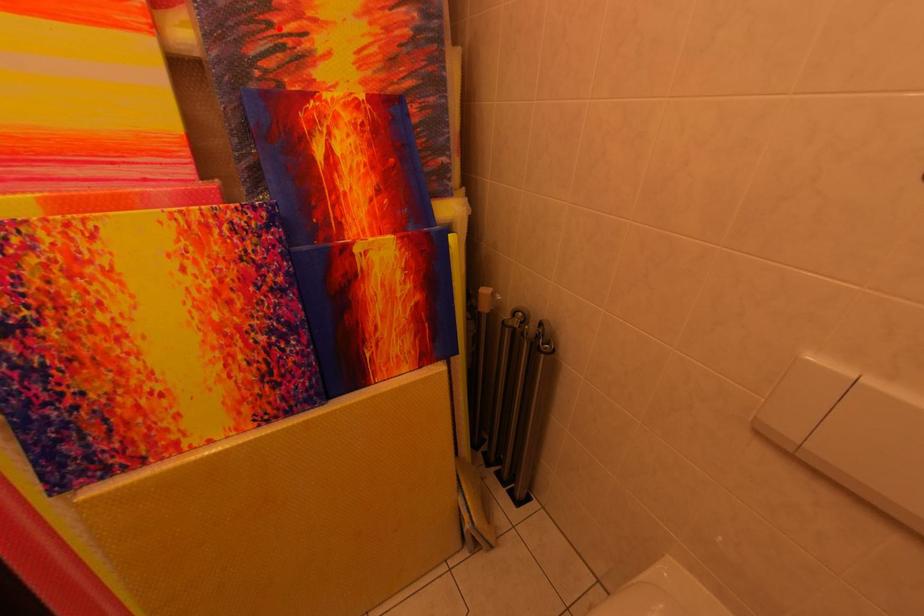
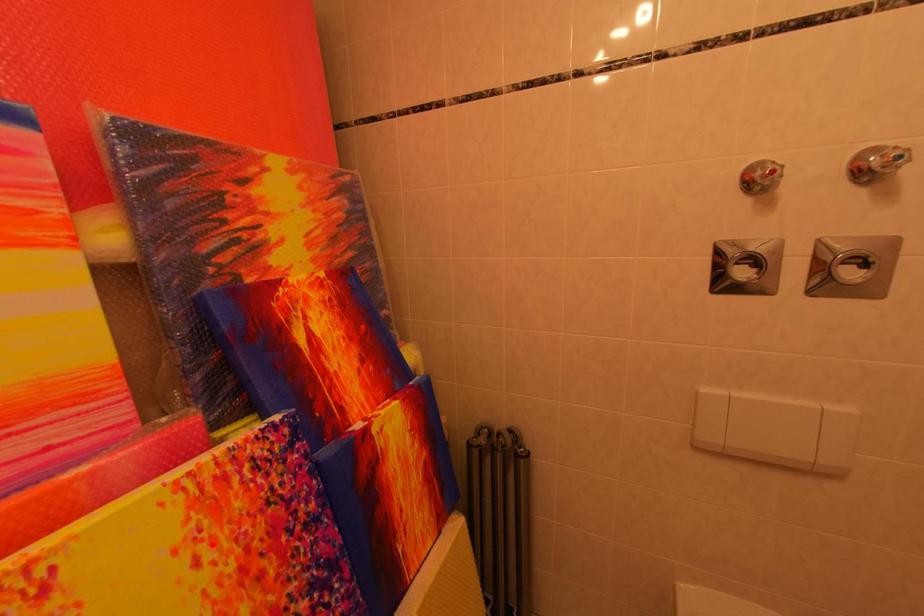
I am providing you with two images of the same scene from different viewpoints. A red point is marked on the first image and another point is marked on the second image. Are the points marked in image1 and image2 representing the same 3D position?

No